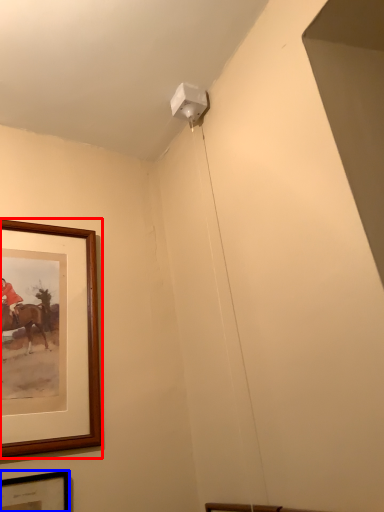
Question: Among these objects, which one is nearest to the camera, picture frame (highlighted by a red box) or picture frame (highlighted by a blue box)?

Choices:
 (A) picture frame
 (B) picture frame

Answer: (B)